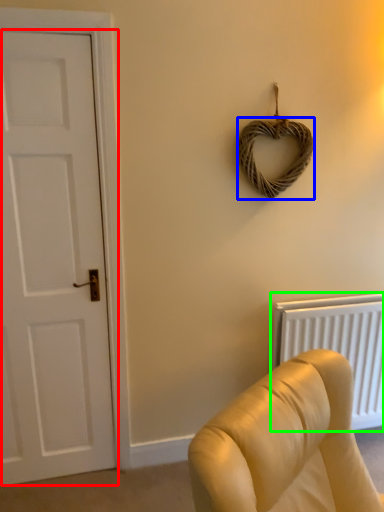
Question: Estimate the real-world distances between objects in this image. Which object is farther from door (highlighted by a red box), rope (highlighted by a blue box) or radiator (highlighted by a green box)?

Choices:
 (A) rope
 (B) radiator

Answer: (B)